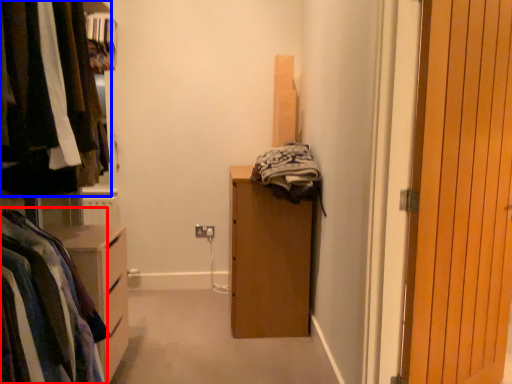
Question: Which of the following is the closest to the observer, clothing (highlighted by a red box) or closet (highlighted by a blue box)?

Choices:
 (A) clothing
 (B) closet

Answer: (B)